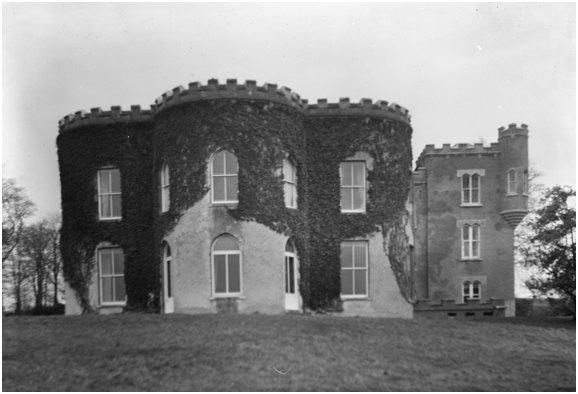
Identify the location of half circle window. [x=166, y=250], [x=222, y=243], [x=290, y=244].